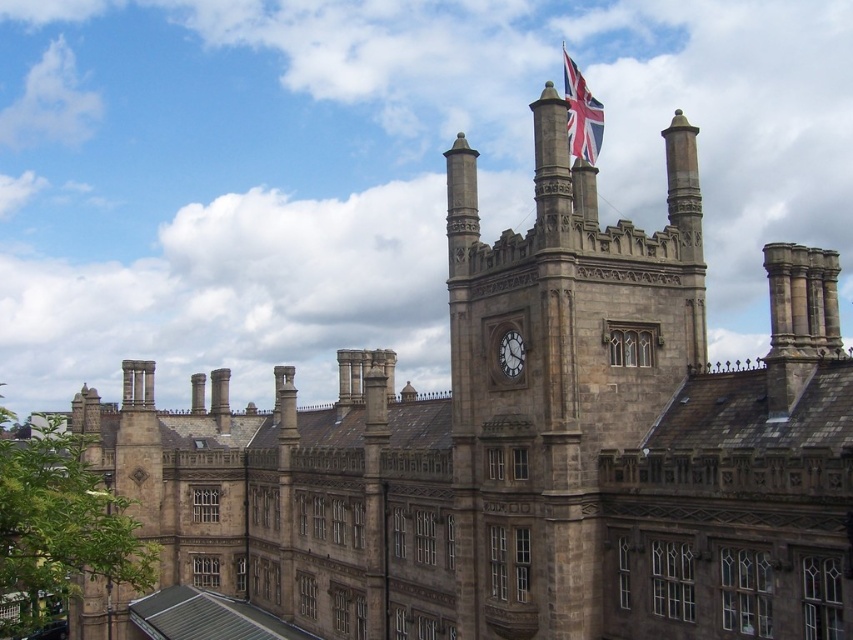
Question: Based on their relative distances, which object is nearer to the polished stone clock at center?

Choices:
 (A) stone clock tower at center
 (B) union jack fabric at top center

Answer: (A)

Question: In this image, where is stone clock tower at center located relative to polished stone clock at center?

Choices:
 (A) below
 (B) above

Answer: (A)

Question: Is union jack fabric at top center smaller than polished stone clock at center?

Choices:
 (A) yes
 (B) no

Answer: (B)

Question: Which object is positioned farthest from the union jack fabric at top center?

Choices:
 (A) polished stone clock at center
 (B) stone clock tower at center

Answer: (B)

Question: Which point is farther from the camera taking this photo?

Choices:
 (A) (517, 369)
 (B) (456, 428)
 (C) (561, 52)

Answer: (C)

Question: Considering the relative positions of stone clock tower at center and union jack fabric at top center in the image provided, where is stone clock tower at center located with respect to union jack fabric at top center?

Choices:
 (A) left
 (B) right

Answer: (A)